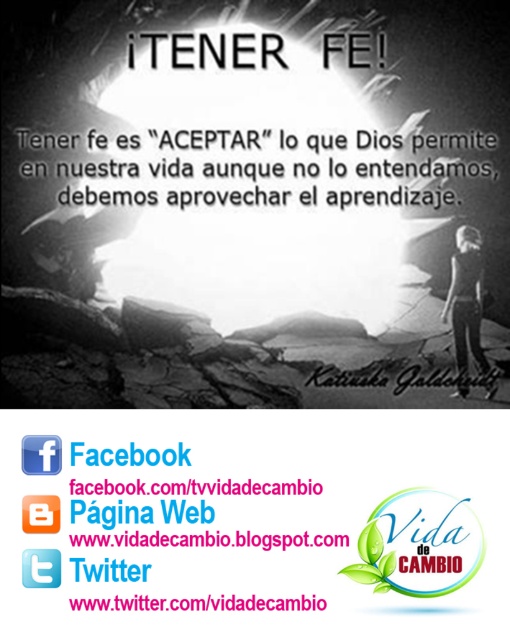
Question: Does white text on transparent background at lower center appear under blue square at upper left?

Choices:
 (A) no
 (B) yes

Answer: (B)

Question: Which point is closer to the camera?

Choices:
 (A) black leather pants at right
 (B) blue square at upper left
 (C) orange plastic square at upper center
 (D) white text on transparent background at lower center

Answer: (D)

Question: Which object appears farthest from the camera in this image?

Choices:
 (A) black leather pants at right
 (B) white text on transparent background at lower center
 (C) orange plastic square at upper center
 (D) green leafy logo at center

Answer: (A)

Question: Estimate the real-world distances between objects in this image. Which object is farther from the orange plastic square at upper center?

Choices:
 (A) white text on transparent background at lower center
 (B) green leafy logo at center

Answer: (B)

Question: Does green leafy logo at center have a smaller size compared to blue square at upper left?

Choices:
 (A) yes
 (B) no

Answer: (B)

Question: Does green leafy logo at center have a greater width compared to white text on transparent background at lower center?

Choices:
 (A) yes
 (B) no

Answer: (B)